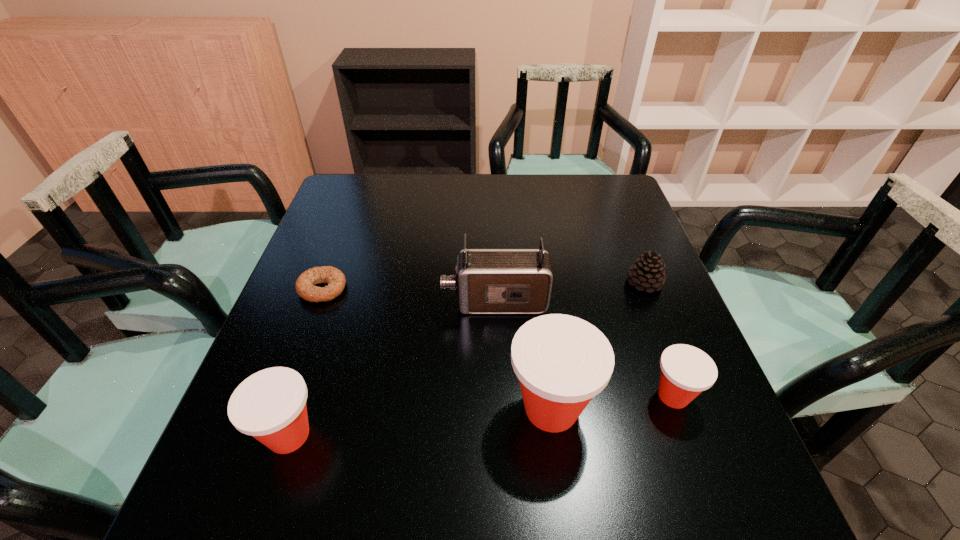
In order to click on free region located at the lens of the camcorder in this screenshot , I will do `click(339, 302)`.

Locate an element on the screen. The image size is (960, 540). vacant position located at the lens of the camcorder is located at coordinates (401, 302).

The image size is (960, 540). I want to click on free space located at the lens of the camcorder, so click(x=406, y=302).

The image size is (960, 540). Identify the location of vacant position located 0.140m at the narrow end of the pinecone. 667,341.

This screenshot has width=960, height=540. Find the location of `vacant space located on the front of the shortest object`. vacant space located on the front of the shortest object is located at coordinates (261, 453).

The image size is (960, 540). In order to click on Dixie cup present at the left edge in this screenshot , I will do `click(270, 405)`.

Find the location of `bagel at the left edge`. bagel at the left edge is located at coordinates (304, 285).

At what (x,y) coordinates should I click in order to perform the action: click on Dixie cup that is at the right edge. Please return your answer as a coordinate pair (x, y). The width and height of the screenshot is (960, 540). Looking at the image, I should click on (686, 371).

Where is `pinecone at the right edge`? pinecone at the right edge is located at coordinates (648, 272).

Where is `object situated at the near left corner`? Image resolution: width=960 pixels, height=540 pixels. object situated at the near left corner is located at coordinates (270, 405).